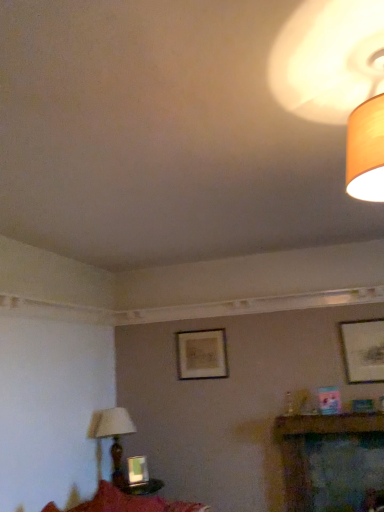
Measure the distance between matte wooden picture frame at center, which is the second picture frame in left-to-right order, and camera.

matte wooden picture frame at center, which is the second picture frame in left-to-right order, is 3.79 meters from camera.

The width and height of the screenshot is (384, 512). What do you see at coordinates (366, 150) in the screenshot? I see `matte beige lampshade at upper right, the first lamp positioned from the top` at bounding box center [366, 150].

What do you see at coordinates (113, 436) in the screenshot? The width and height of the screenshot is (384, 512). I see `wooden lampshade at lower left, which is counted as the second lamp, starting from the right` at bounding box center [113, 436].

Where is `matte black picture frame at upper right, the 1th picture frame viewed from the right`? The image size is (384, 512). matte black picture frame at upper right, the 1th picture frame viewed from the right is located at coordinates (363, 350).

In the scene shown: Is matte black picture frame at upper right, the first picture frame when ordered from top to bottom, oriented away from wooden lampshade at lower left, which appears as the first lamp when viewed from the back?

That's not correct — matte black picture frame at upper right, the first picture frame when ordered from top to bottom, is not looking away from wooden lampshade at lower left, which appears as the first lamp when viewed from the back.

Is matte black picture frame at upper right, the first picture frame when ordered from top to bottom, next to wooden lampshade at lower left, which ranks as the 1th lamp in left-to-right order?

No, matte black picture frame at upper right, the first picture frame when ordered from top to bottom, is not touching wooden lampshade at lower left, which ranks as the 1th lamp in left-to-right order.

Is matte black picture frame at upper right, the first picture frame when ordered from top to bottom, closer to the viewer compared to wooden lampshade at lower left, which appears as the first lamp when viewed from the back?

No, matte black picture frame at upper right, the first picture frame when ordered from top to bottom, is further to the viewer.

Who is taller, matte black picture frame at upper right, marked as the 3th picture frame in a left-to-right arrangement, or wooden lampshade at lower left, which is counted as the second lamp, starting from the right?

wooden lampshade at lower left, which is counted as the second lamp, starting from the right, is taller.

Is matte beige lampshade at upper right, the first lamp positioned from the top, facing towards matte wooden picture frame at center, the 1th picture frame in the back-to-front sequence?

No, matte beige lampshade at upper right, the first lamp positioned from the top, is not facing towards matte wooden picture frame at center, the 1th picture frame in the back-to-front sequence.

Considering the sizes of objects matte beige lampshade at upper right, which is counted as the 2th lamp, starting from the left, and matte wooden picture frame at center, positioned as the 2th picture frame in right-to-left order, in the image provided, who is wider, matte beige lampshade at upper right, which is counted as the 2th lamp, starting from the left, or matte wooden picture frame at center, positioned as the 2th picture frame in right-to-left order,?

matte beige lampshade at upper right, which is counted as the 2th lamp, starting from the left, is wider.

Between matte beige lampshade at upper right, which is the second lamp from back to front, and matte wooden picture frame at center, the 1th picture frame in the back-to-front sequence, which one has less height?

matte beige lampshade at upper right, which is the second lamp from back to front.

Can you confirm if matte beige lampshade at upper right, which ranks as the first lamp in right-to-left order, is smaller than matte wooden picture frame at center, the 1th picture frame in the back-to-front sequence?

Incorrect, matte beige lampshade at upper right, which ranks as the first lamp in right-to-left order, is not smaller in size than matte wooden picture frame at center, the 1th picture frame in the back-to-front sequence.

Is matte wooden picture frame at center, which ranks as the third picture frame in front-to-back order, oriented towards matte beige lampshade at upper right, which is the 1th lamp from front to back?

No, matte wooden picture frame at center, which ranks as the third picture frame in front-to-back order, is not turned towards matte beige lampshade at upper right, which is the 1th lamp from front to back.

Is matte wooden picture frame at center, which ranks as the third picture frame in front-to-back order, behind matte beige lampshade at upper right, the first lamp positioned from the top?

Yes, it is behind matte beige lampshade at upper right, the first lamp positioned from the top.

From the picture: Between matte wooden picture frame at center, the second picture frame positioned from the bottom, and matte beige lampshade at upper right, the first lamp positioned from the top, which one has smaller size?

matte wooden picture frame at center, the second picture frame positioned from the bottom.

Between wooden lampshade at lower left, arranged as the first lamp when ordered from the bottom, and matte wooden picture frame at center, the second picture frame positioned from the bottom, which one has smaller size?

matte wooden picture frame at center, the second picture frame positioned from the bottom, is smaller.

Would you say wooden lampshade at lower left, arranged as the first lamp when ordered from the bottom, is to the left or to the right of matte wooden picture frame at center, arranged as the 2th picture frame when viewed from the top, in the picture?

Based on their positions, wooden lampshade at lower left, arranged as the first lamp when ordered from the bottom, is located to the left of matte wooden picture frame at center, arranged as the 2th picture frame when viewed from the top.

Can you confirm if wooden lampshade at lower left, which appears as the first lamp when viewed from the back, is wider than matte wooden picture frame at center, which ranks as the third picture frame in front-to-back order?

Indeed, wooden lampshade at lower left, which appears as the first lamp when viewed from the back, has a greater width compared to matte wooden picture frame at center, which ranks as the third picture frame in front-to-back order.

Is matte wooden picture frame at center, which ranks as the third picture frame in front-to-back order, positioned before wooden lampshade at lower left, which appears as the 2th lamp when viewed from the front?

No.

Is matte wooden picture frame at center, the second picture frame positioned from the bottom, oriented towards wooden lampshade at lower left, the second lamp positioned from the top?

No, matte wooden picture frame at center, the second picture frame positioned from the bottom, does not turn towards wooden lampshade at lower left, the second lamp positioned from the top.

From the image's perspective, between matte wooden picture frame at center, which ranks as the third picture frame in front-to-back order, and wooden lampshade at lower left, arranged as the first lamp when ordered from the bottom, which one is located above?

matte wooden picture frame at center, which ranks as the third picture frame in front-to-back order, from the image's perspective.

From a real-world perspective, which object rests below the other?

wooden lampshade at lower left, which appears as the 2th lamp when viewed from the front.

From the image's perspective, which one is positioned higher, metallic silver picture frame at lower center, which is counted as the 1th picture frame, starting from the bottom, or matte wooden picture frame at center, which is the second picture frame in left-to-right order?

From the image's view, matte wooden picture frame at center, which is the second picture frame in left-to-right order, is above.

Is metallic silver picture frame at lower center, which is counted as the 1th picture frame, starting from the bottom, at the left side of matte wooden picture frame at center, the second picture frame positioned from the bottom?

Yes.

Is metallic silver picture frame at lower center, which is the second picture frame from back to front, not near matte wooden picture frame at center, which ranks as the third picture frame in front-to-back order?

Absolutely, metallic silver picture frame at lower center, which is the second picture frame from back to front, is distant from matte wooden picture frame at center, which ranks as the third picture frame in front-to-back order.

Relative to matte wooden picture frame at center, arranged as the 2th picture frame when viewed from the top, is matte black picture frame at upper right, marked as the 3th picture frame in a left-to-right arrangement, in front or behind?

In the image, matte black picture frame at upper right, marked as the 3th picture frame in a left-to-right arrangement, appears in front of matte wooden picture frame at center, arranged as the 2th picture frame when viewed from the top.

Is matte wooden picture frame at center, the 1th picture frame in the back-to-front sequence, completely or partially inside matte black picture frame at upper right, which ranks as the 3th picture frame in bottom-to-top order?

Actually, matte wooden picture frame at center, the 1th picture frame in the back-to-front sequence, is outside matte black picture frame at upper right, which ranks as the 3th picture frame in bottom-to-top order.

I want to click on the 1st picture frame below when counting from the matte black picture frame at upper right, which is counted as the 1th picture frame, starting from the front (from the image's perspective), so click(x=201, y=354).

Who is shorter, matte black picture frame at upper right, the first picture frame when ordered from top to bottom, or matte wooden picture frame at center, the second picture frame positioned from the bottom?

matte wooden picture frame at center, the second picture frame positioned from the bottom.

The height and width of the screenshot is (512, 384). Find the location of `the 1st lamp in front of the matte black picture frame at upper right, the 3th picture frame in the back-to-front sequence, counting from the anchor's position`. the 1st lamp in front of the matte black picture frame at upper right, the 3th picture frame in the back-to-front sequence, counting from the anchor's position is located at coordinates (113, 436).

From the image's perspective, starting from the matte beige lampshade at upper right, which is counted as the 2th lamp, starting from the left, which picture frame is the 2nd one below? Please provide its 2D coordinates.

[(201, 354)]

When comparing their distances from matte wooden picture frame at center, which is the second picture frame in left-to-right order, does metallic silver picture frame at lower center, the third picture frame when ordered from right to left, or matte black picture frame at upper right, the 3th picture frame in the back-to-front sequence, seem closer?

metallic silver picture frame at lower center, the third picture frame when ordered from right to left, is closer to matte wooden picture frame at center, which is the second picture frame in left-to-right order.

Based on their spatial positions, is matte black picture frame at upper right, which is counted as the 1th picture frame, starting from the front, or wooden lampshade at lower left, the second lamp positioned from the top, closer to matte wooden picture frame at center, positioned as the 2th picture frame in right-to-left order?

Among the two, wooden lampshade at lower left, the second lamp positioned from the top, is located nearer to matte wooden picture frame at center, positioned as the 2th picture frame in right-to-left order.

Estimate the real-world distances between objects in this image. Which object is further from matte black picture frame at upper right, the 1th picture frame viewed from the right, matte wooden picture frame at center, which ranks as the third picture frame in front-to-back order, or matte beige lampshade at upper right, which is the 1th lamp from front to back?

Based on the image, matte beige lampshade at upper right, which is the 1th lamp from front to back, appears to be further to matte black picture frame at upper right, the 1th picture frame viewed from the right.

Which object lies nearer to the anchor point metallic silver picture frame at lower center, which is the second picture frame from front to back, wooden lampshade at lower left, which ranks as the 1th lamp in left-to-right order, or matte beige lampshade at upper right, which is the second lamp from back to front?

Based on the image, wooden lampshade at lower left, which ranks as the 1th lamp in left-to-right order, appears to be nearer to metallic silver picture frame at lower center, which is the second picture frame from front to back.

From the image, which object appears to be nearer to metallic silver picture frame at lower center, which is the second picture frame from front to back, matte wooden picture frame at center, positioned as the 2th picture frame in right-to-left order, or wooden lampshade at lower left, which ranks as the 1th lamp in left-to-right order?

Among the two, wooden lampshade at lower left, which ranks as the 1th lamp in left-to-right order, is located nearer to metallic silver picture frame at lower center, which is the second picture frame from front to back.

Considering their positions, is matte black picture frame at upper right, the 1th picture frame viewed from the right, positioned further to metallic silver picture frame at lower center, which ranks as the first picture frame in left-to-right order, than matte wooden picture frame at center, the 1th picture frame in the back-to-front sequence?

Among the two, matte black picture frame at upper right, the 1th picture frame viewed from the right, is located further to metallic silver picture frame at lower center, which ranks as the first picture frame in left-to-right order.

Considering their positions, is matte wooden picture frame at center, which ranks as the third picture frame in front-to-back order, positioned further to metallic silver picture frame at lower center, which is counted as the 1th picture frame, starting from the bottom, than matte black picture frame at upper right, the 3th picture frame in the back-to-front sequence?

The object further to metallic silver picture frame at lower center, which is counted as the 1th picture frame, starting from the bottom, is matte black picture frame at upper right, the 3th picture frame in the back-to-front sequence.

From the image, which object appears to be farther from matte beige lampshade at upper right, which is the 1th lamp from front to back, matte black picture frame at upper right, the 1th picture frame viewed from the right, or wooden lampshade at lower left, the second lamp positioned from the top?

wooden lampshade at lower left, the second lamp positioned from the top, is positioned further to the anchor matte beige lampshade at upper right, which is the 1th lamp from front to back.

I want to click on lamp between matte beige lampshade at upper right, which ranks as the first lamp in right-to-left order, and metallic silver picture frame at lower center, which ranks as the first picture frame in left-to-right order, in the front-back direction, so click(113, 436).

The height and width of the screenshot is (512, 384). In order to click on lamp located between matte beige lampshade at upper right, the 2th lamp from the bottom, and matte black picture frame at upper right, which ranks as the 3th picture frame in bottom-to-top order, in the depth direction in this screenshot , I will do `click(113, 436)`.

I want to click on lamp positioned between matte beige lampshade at upper right, the 2th lamp from the bottom, and matte wooden picture frame at center, which is the second picture frame in left-to-right order, from near to far, so click(x=113, y=436).

You are a GUI agent. You are given a task and a screenshot of the screen. Output one action in this format:
    pyautogui.click(x=<x>, y=<y>)
    Task: Click on the lamp between matte wooden picture frame at center, which is the second picture frame in left-to-right order, and metallic silver picture frame at lower center, which is the second picture frame from back to front, from top to bottom
    
    Given the screenshot: What is the action you would take?
    pyautogui.click(x=113, y=436)